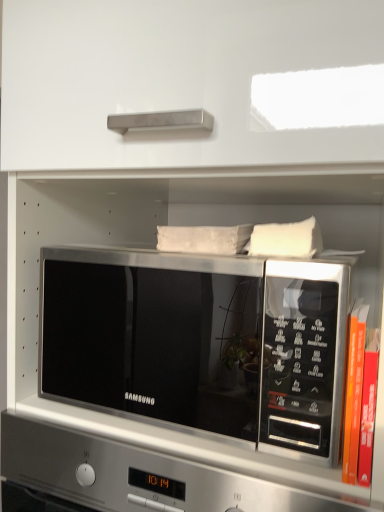
Question: Considering their positions, is white soft pillow at upper right located in front of or behind orange hardcover book at right?

Choices:
 (A) front
 (B) behind

Answer: (B)

Question: From their relative heights in the image, would you say white soft pillow at upper right is taller or shorter than orange hardcover book at right?

Choices:
 (A) short
 (B) tall

Answer: (A)

Question: Which object is positioned closest to the white soft pillow at upper right?

Choices:
 (A) orange hardcover book at right
 (B) satin silver microwave at center

Answer: (A)

Question: Considering the real-world distances, which object is closest to the satin silver microwave at center?

Choices:
 (A) orange hardcover book at right
 (B) white soft pillow at upper right

Answer: (B)